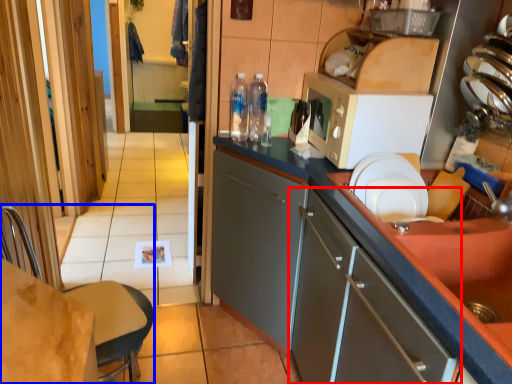
Question: Which point is further to the camera, cabinetry (highlighted by a red box) or chair (highlighted by a blue box)?

Choices:
 (A) cabinetry
 (B) chair

Answer: (B)